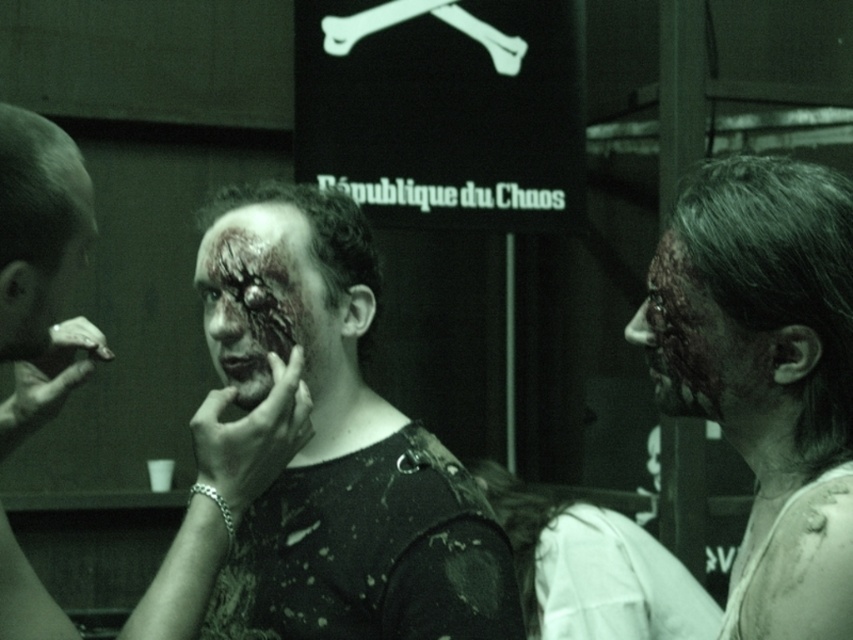
You are a makeup artist observing the scene. You notice two faces in the image. The first has matte black face paint at center, and the second has a grungy textured face at right. Which face is positioned lower in the image?

The matte black face paint at center is located below the grungy textured face at right, so the matte black face paint at center is positioned lower in the image.

You are a makeup artist observing the scene. You notice two areas with matte black face paint at right and matte black face at left. Which one is located below the other?

The matte black face paint at right is positioned under the matte black face at left.

You are standing in front of the scene and want to reach both point A at coordinates point (740, 368) and point B at coordinates point (74, 173). Which point will you reach first?

You will reach point A at coordinates point (740, 368) first because it is closer to you than point B at coordinates point (74, 173), which is further away.